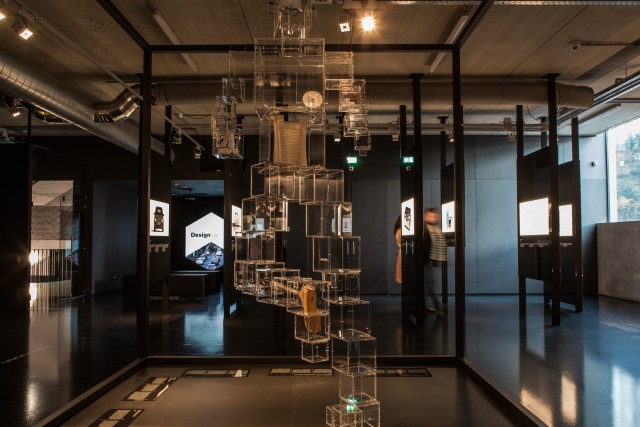
At what (x,y) coordinates should I click in order to perform the action: click on window. Please return your answer as a coordinate pair (x, y). Image resolution: width=640 pixels, height=427 pixels. Looking at the image, I should click on (626, 181).